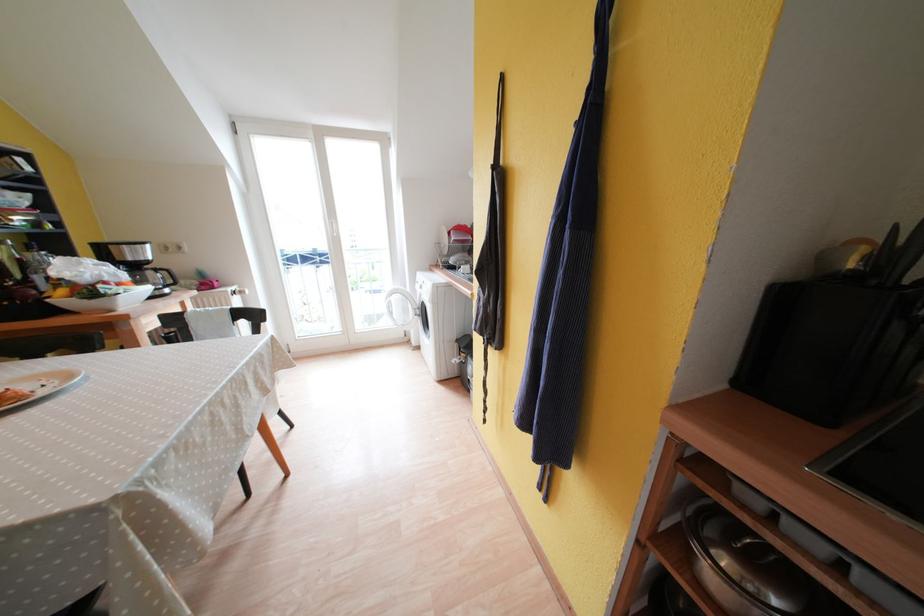
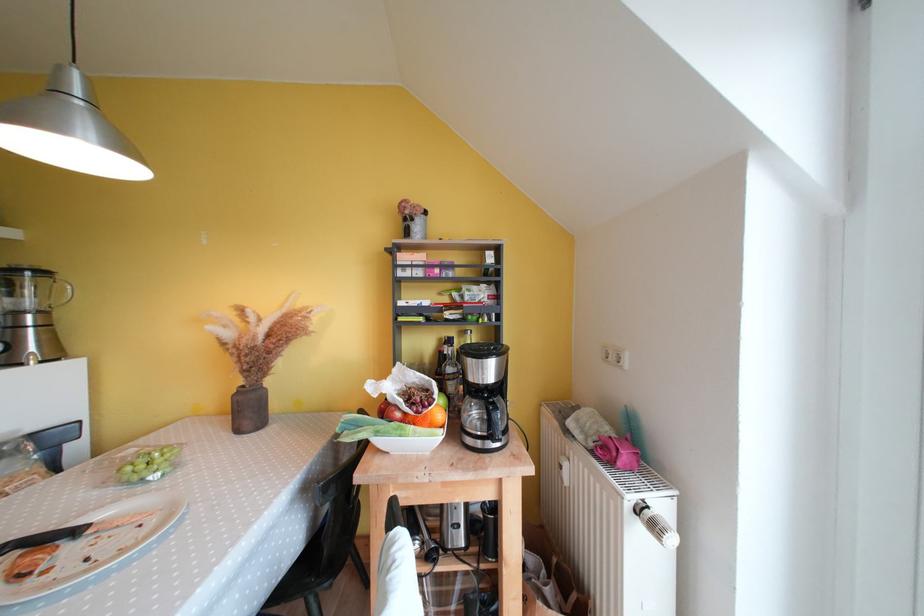
The point at (152,257) is marked in the first image. Where is the corresponding point in the second image?

(494, 376)